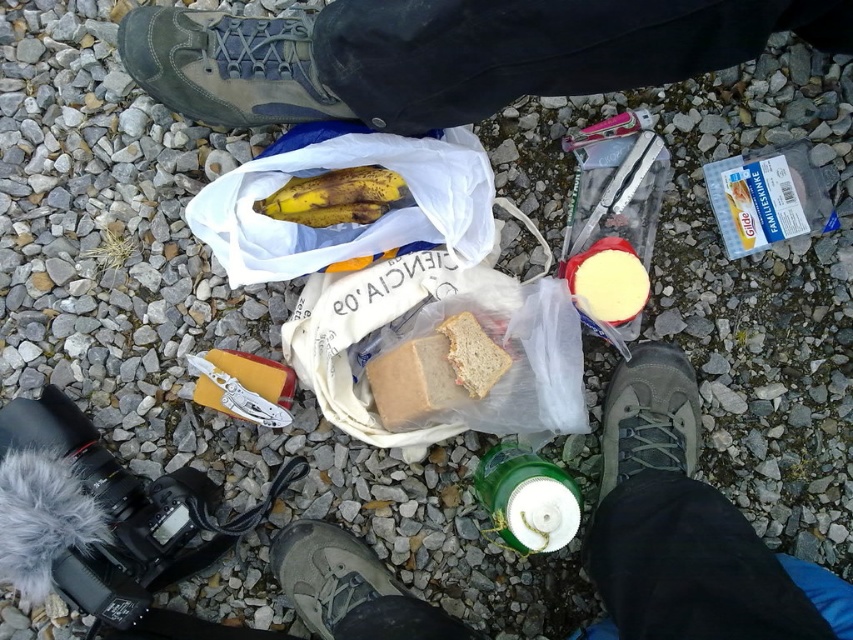
Question: From the image, what is the correct spatial relationship of dark gray fabric pants at upper center in relation to matte gray shoe at lower center?

Choices:
 (A) above
 (B) below

Answer: (A)

Question: Is gray fabric shoe at lower right wider than brown matte bread at center?

Choices:
 (A) no
 (B) yes

Answer: (B)

Question: Does brown matte bread at center appear under yellowish-brown peel banana at center?

Choices:
 (A) no
 (B) yes

Answer: (B)

Question: Which point appears farthest from the camera in this image?

Choices:
 (A) (657, 429)
 (B) (375, 563)

Answer: (B)

Question: Among these objects, which one is farthest from the camera?

Choices:
 (A) slightly toasted bread at center
 (B) green plastic bottle at center
 (C) yellowish-brown peel banana at center
 (D) matte gray shoe at lower center

Answer: (C)

Question: Which point is closer to the camera?

Choices:
 (A) (318, 564)
 (B) (376, 35)

Answer: (B)